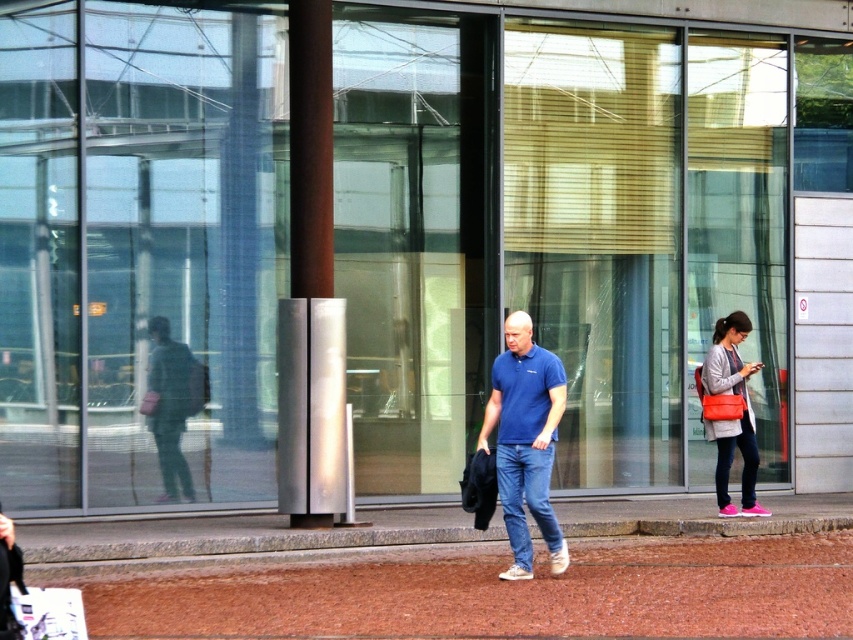
Does brown gravel at center appear on the left side of matte pink sneakers at right?

Indeed, brown gravel at center is positioned on the left side of matte pink sneakers at right.

At what (x,y) coordinates should I click in order to perform the action: click on brown gravel at center. Please return your answer as a coordinate pair (x, y). Looking at the image, I should click on (491, 593).

The width and height of the screenshot is (853, 640). What do you see at coordinates (491, 593) in the screenshot?
I see `brown gravel at center` at bounding box center [491, 593].

Find the location of a particular element. The width and height of the screenshot is (853, 640). brown gravel at center is located at coordinates (491, 593).

Which of these two, brown gravel at center or silver metallic pole at center, stands shorter?

brown gravel at center

Where is `brown gravel at center`? brown gravel at center is located at coordinates (491, 593).

Locate an element on the screen. Image resolution: width=853 pixels, height=640 pixels. brown gravel at center is located at coordinates (491, 593).

From the picture: Is green fabric jacket at left thinner than matte pink sneakers at right?

Yes.

Between green fabric jacket at left and matte pink sneakers at right, which one has more height?

matte pink sneakers at right

Where is `green fabric jacket at left`? This screenshot has width=853, height=640. green fabric jacket at left is located at coordinates (171, 404).